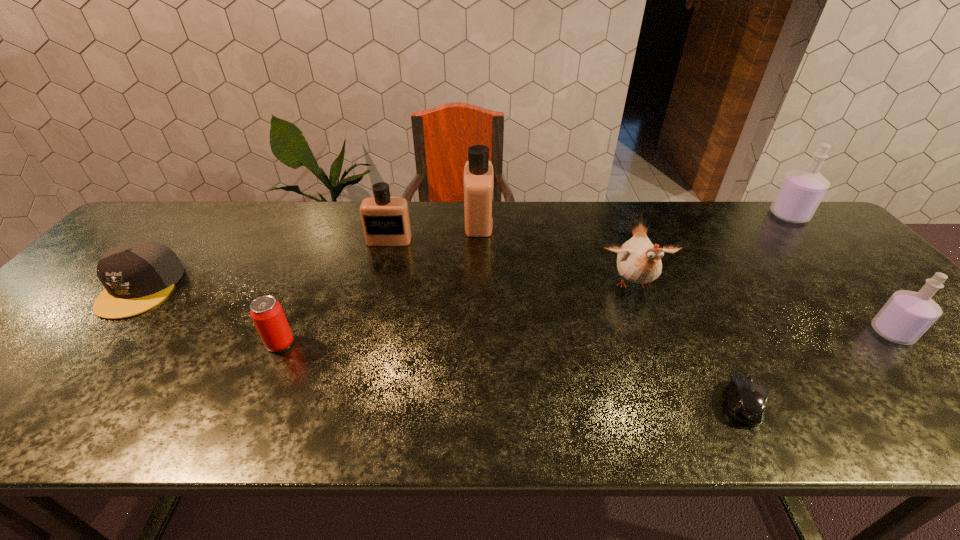
This screenshot has width=960, height=540. Identify the location of free space located on the front-facing side of the cap. (73, 367).

Identify the location of vacant space located on the back of the mouse. (680, 277).

Where is `object present at the near edge`? object present at the near edge is located at coordinates (746, 399).

Image resolution: width=960 pixels, height=540 pixels. Find the location of `object located at the left edge`. object located at the left edge is located at coordinates (137, 276).

Find the location of `object present at the far right corner`. object present at the far right corner is located at coordinates (801, 191).

Identify the location of free location at the far edge of the desktop. (671, 217).

At what (x,y) coordinates should I click in order to perform the action: click on vacant space at the near edge of the desktop. Please return your answer as a coordinate pair (x, y). Looking at the image, I should click on (146, 413).

Locate an element on the screen. vacant space at the left edge of the desktop is located at coordinates (12, 364).

Find the location of a particular element. vacant space at the right edge of the desktop is located at coordinates (822, 281).

In the image, there is a desktop. Where is `vacant space at the far left corner`? vacant space at the far left corner is located at coordinates (180, 231).